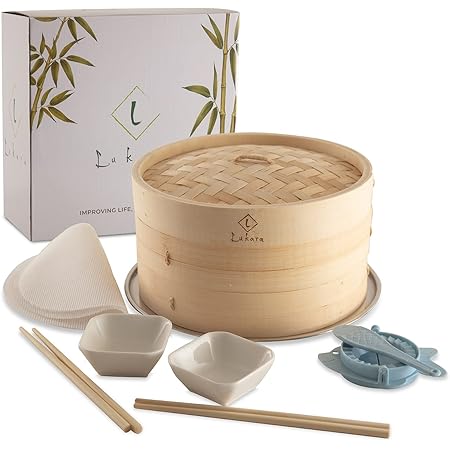
Locate an element on the screen. Image resolution: width=450 pixels, height=450 pixels. chopsticks is located at coordinates pyautogui.click(x=103, y=398), pyautogui.click(x=253, y=416).